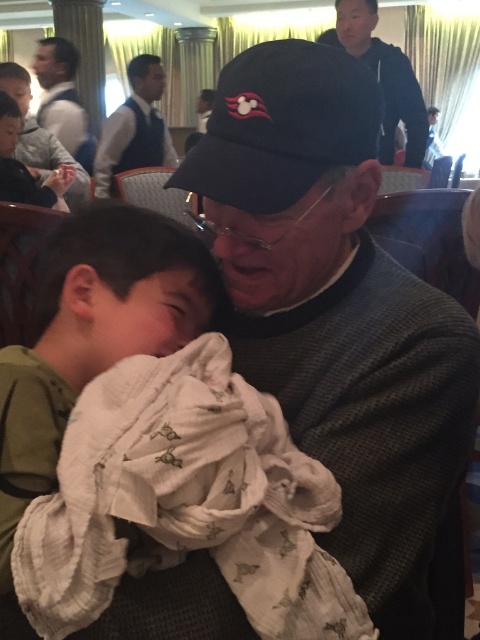
Question: Which of the following is the farthest from the observer?

Choices:
 (A) (54, 234)
 (B) (136, 60)

Answer: (B)

Question: Which point is farther from the camera taking this photo?

Choices:
 (A) (264, 104)
 (B) (404, 116)
 (C) (71, 45)

Answer: (C)

Question: Is dark blue sweater at upper center wider than matte black shirt at upper left?

Choices:
 (A) no
 (B) yes

Answer: (B)

Question: Is white cotton blanket at center wider than dark blue sweater at upper center?

Choices:
 (A) no
 (B) yes

Answer: (A)

Question: Considering the real-world distances, which object is farthest from the dark blue sweater at upper center?

Choices:
 (A) matte black vest at upper left
 (B) black knitwear at center
 (C) matte black shirt at upper left
 (D) white cotton blanket at center

Answer: (D)

Question: Is dark blue sweater at upper center thinner than matte black vest at upper left?

Choices:
 (A) yes
 (B) no

Answer: (B)